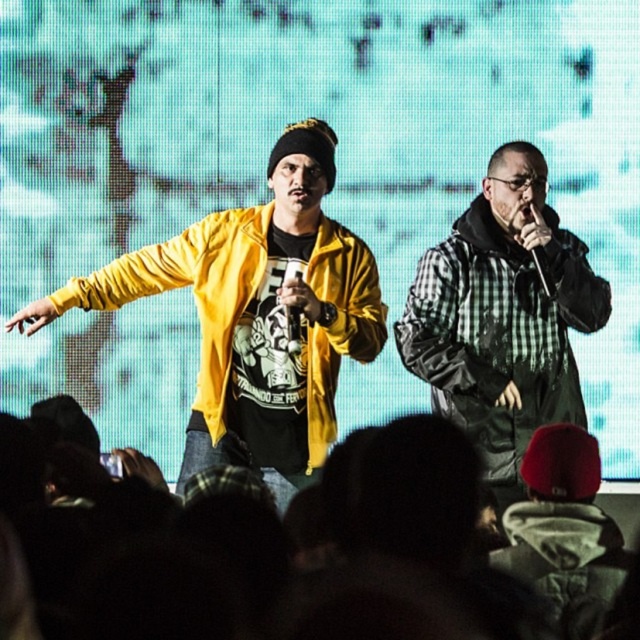
Who is lower down, dark fabric crowd at lower center or checkered fabric jacket at right?

dark fabric crowd at lower center

Looking at this image, between dark fabric crowd at lower center and checkered fabric jacket at right, which one has more height?

With more height is checkered fabric jacket at right.

At what (x,y) coordinates should I click in order to perform the action: click on dark fabric crowd at lower center. Please return your answer as a coordinate pair (x, y). Looking at the image, I should click on (305, 572).

How much distance is there between checkered fabric jacket at right and metallic silver microphone at center-right?

checkered fabric jacket at right is 7.97 feet from metallic silver microphone at center-right.

Can you confirm if checkered fabric jacket at right is positioned above metallic silver microphone at center-right?

No, checkered fabric jacket at right is not above metallic silver microphone at center-right.

This screenshot has width=640, height=640. I want to click on checkered fabric jacket at right, so click(x=502, y=317).

The image size is (640, 640). Identify the location of checkered fabric jacket at right. (502, 317).

Between point (115, 602) and point (314, 355), which one is positioned in front?

Point (115, 602) is in front.

In the scene shown: Between dark fabric crowd at lower center and yellow matte jacket at left, which one appears on the left side from the viewer's perspective?

Positioned to the left is yellow matte jacket at left.

The image size is (640, 640). Describe the element at coordinates (305, 572) in the screenshot. I see `dark fabric crowd at lower center` at that location.

Locate an element on the screen. Image resolution: width=640 pixels, height=640 pixels. dark fabric crowd at lower center is located at coordinates (305, 572).